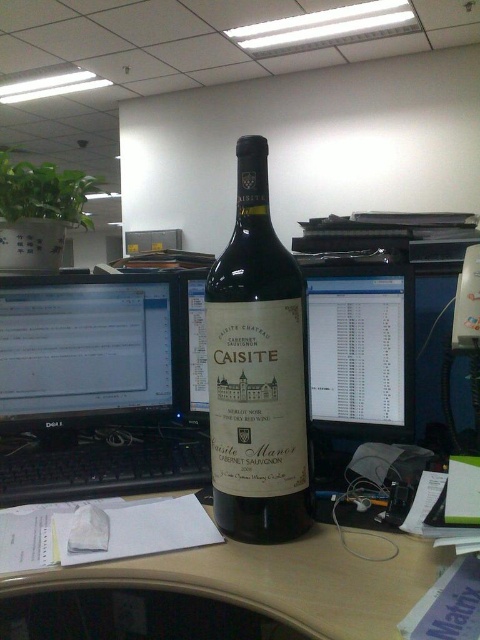
How distant is matte glass wine bottle at center from matte black monitor at center?

The distance of matte glass wine bottle at center from matte black monitor at center is 26.16 centimeters.

Is point (240, 493) positioned before point (376, 397)?

Yes, point (240, 493) is in front of point (376, 397).

In the scene shown: Measure the distance between matte glass wine bottle at center and camera.

A distance of 36.18 inches exists between matte glass wine bottle at center and camera.

At what (x,y) coordinates should I click in order to perform the action: click on matte glass wine bottle at center. Please return your answer as a coordinate pair (x, y). The width and height of the screenshot is (480, 640). Looking at the image, I should click on (257, 371).

Can you confirm if black glossy monitor at left is shorter than matte black monitor at center?

No.

Who is shorter, black glossy monitor at left or matte black monitor at center?

With less height is matte black monitor at center.

Measure the distance between black glossy monitor at left and camera.

A distance of 1.07 meters exists between black glossy monitor at left and camera.

Find the location of `black glossy monitor at left`. black glossy monitor at left is located at coordinates (101, 385).

Which is below, black glossy monitor at left or matte glass wine bottle at center?

black glossy monitor at left

Does black glossy monitor at left have a lesser width compared to matte glass wine bottle at center?

No.

Does point (132, 356) come farther from viewer compared to point (237, 472)?

Yes, point (132, 356) is farther from viewer.

Where is `black glossy monitor at left`? The height and width of the screenshot is (640, 480). black glossy monitor at left is located at coordinates (101, 385).